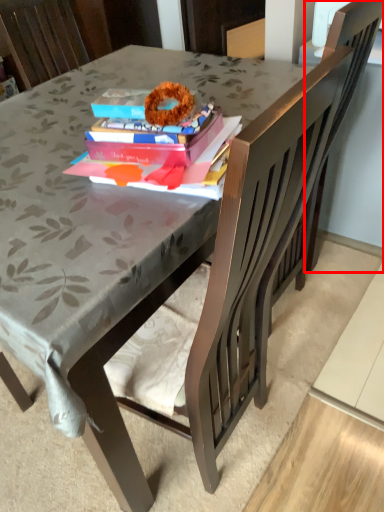
Question: Considering the relative positions of swivel chair (annotated by the red box) and book in the image provided, where is swivel chair (annotated by the red box) located with respect to the staircase?

Choices:
 (A) left
 (B) right

Answer: (B)